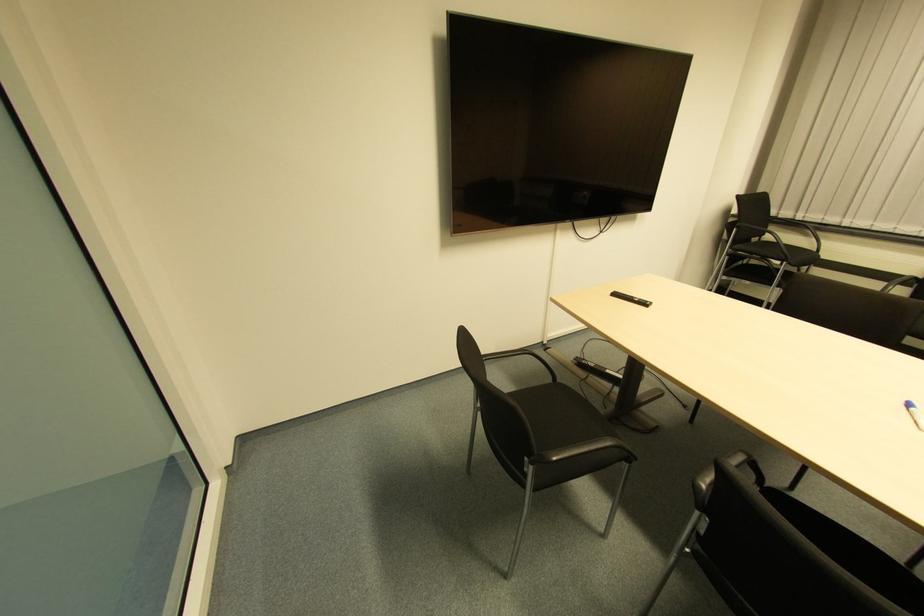
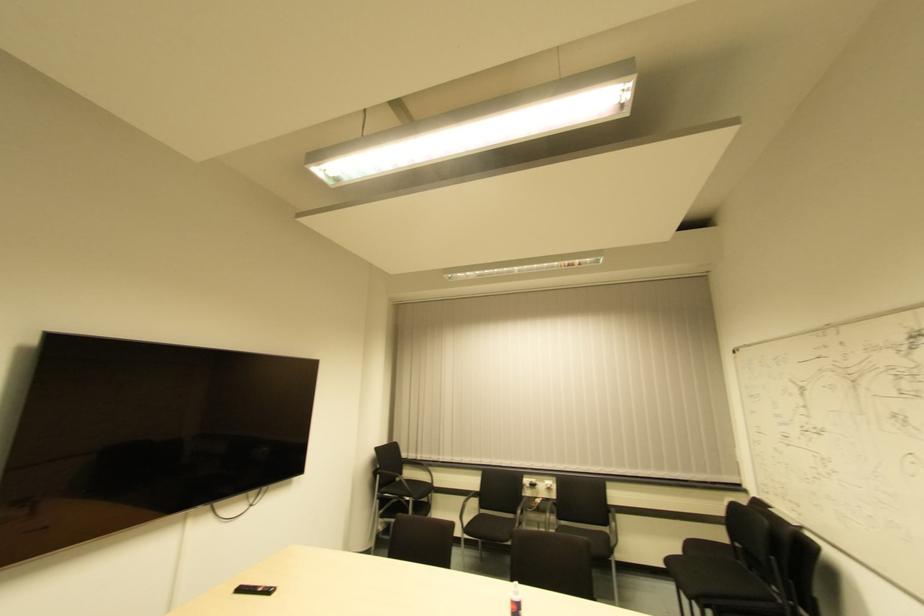
Based on the continuous images, in which direction is the camera rotating?

The camera rotated toward right-up.